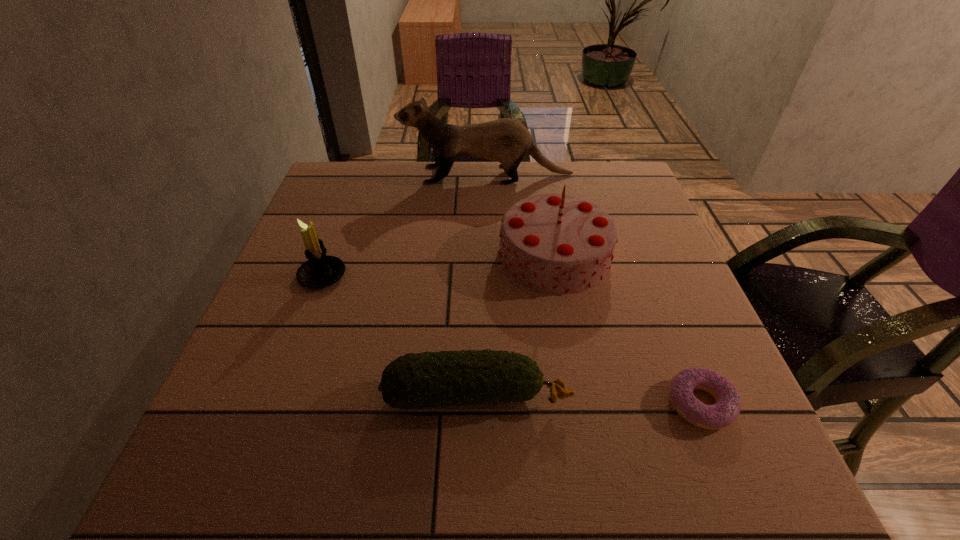
Where is `the farthest object`? the farthest object is located at coordinates (505, 140).

You are a GUI agent. You are given a task and a screenshot of the screen. Output one action in this format:
    pyautogui.click(x=<x>, y=<y>)
    Task: Click on the birthday cake
    This screenshot has width=960, height=540.
    Given the screenshot: What is the action you would take?
    pyautogui.click(x=560, y=244)

Find the location of a particular element. the leftmost object is located at coordinates (320, 270).

In order to click on the fourth tallest object in this screenshot , I will do `click(430, 379)`.

This screenshot has height=540, width=960. What are the coordinates of `doughnut` in the screenshot? It's located at (725, 411).

The height and width of the screenshot is (540, 960). What are the coordinates of `the rightmost object` in the screenshot? It's located at (725, 411).

Locate an element on the screen. This screenshot has width=960, height=540. vacant space located on the face of the farthest object is located at coordinates (324, 175).

Where is `vacant region located 0.220m on the face of the farthest object`? The height and width of the screenshot is (540, 960). vacant region located 0.220m on the face of the farthest object is located at coordinates (324, 175).

Image resolution: width=960 pixels, height=540 pixels. Find the location of `free location located on the face of the farthest object`. free location located on the face of the farthest object is located at coordinates (339, 175).

Where is `vacant space located 0.220m on the left of the birthday cake`? The width and height of the screenshot is (960, 540). vacant space located 0.220m on the left of the birthday cake is located at coordinates (402, 255).